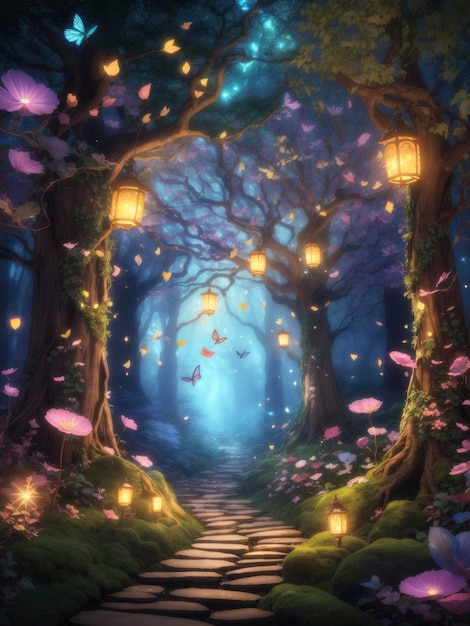
At what (x,y) coordinates should I click in order to perform the action: click on orange lights. Please return your answer as a coordinate pair (x, y). Looking at the image, I should click on (405, 183), (315, 263), (262, 260), (211, 302), (283, 337), (332, 516), (122, 496), (154, 506), (135, 205).